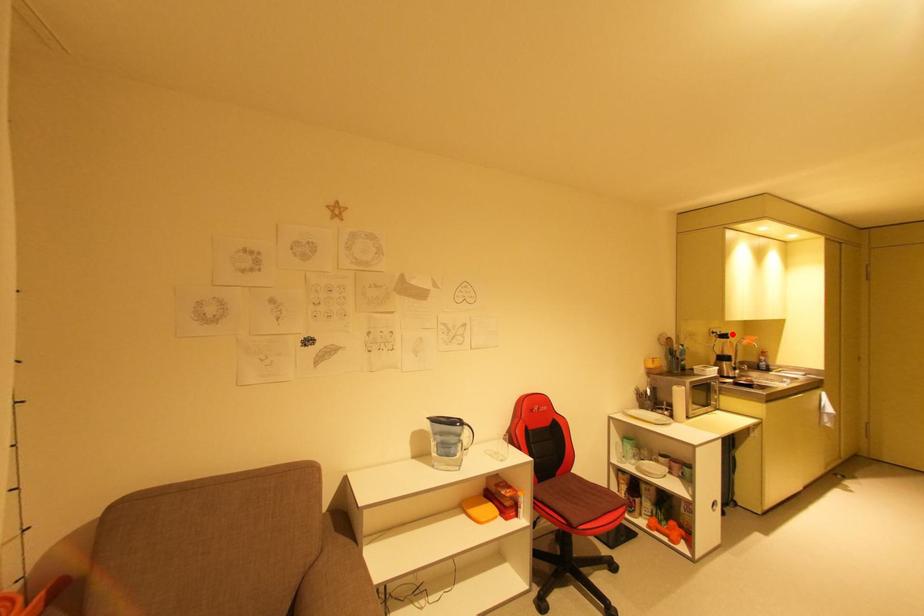
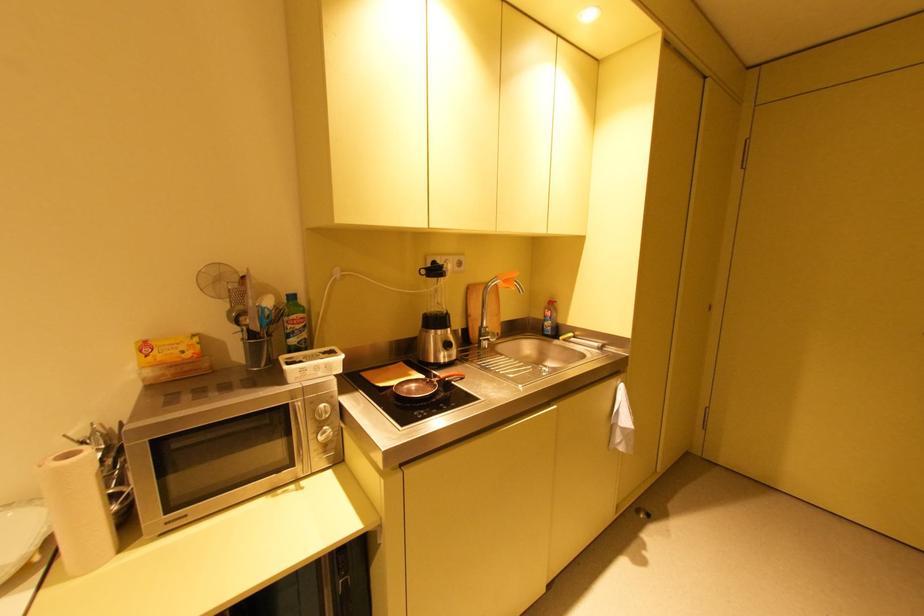
Where in the second image is the point corresponding to the highlighted location from the first image?

(444, 267)